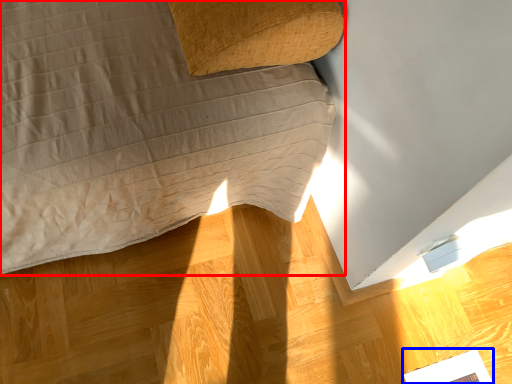
Question: Which object appears closest to the camera in this image, furniture (highlighted by a red box) or magazine (highlighted by a blue box)?

Choices:
 (A) furniture
 (B) magazine

Answer: (A)